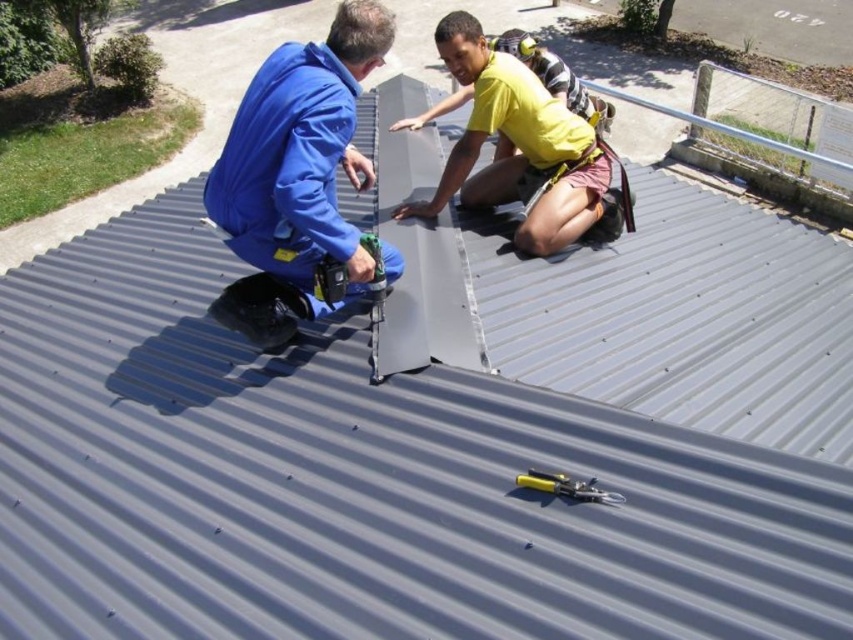
What is the exact location of the yellow matte shirt at upper center on the roof?

The yellow matte shirt at upper center is located at point coordinates of 0.233 on the x axis and 0.613 on the y axis.

You are a safety inspector assessing the roof work area. You notice the matte blue jumpsuit at upper left and the yellow matte shirt at upper center. Which worker is more likely to be in a position that requires immediate attention based on their clothing size relative to their body? Explain your reasoning.

The matte blue jumpsuit at upper left has a smaller size compared to the yellow matte shirt at upper center. This suggests the worker in the smaller matte blue jumpsuit may not be wearing properly fitted protective gear, which could indicate a safety hazard requiring immediate attention.